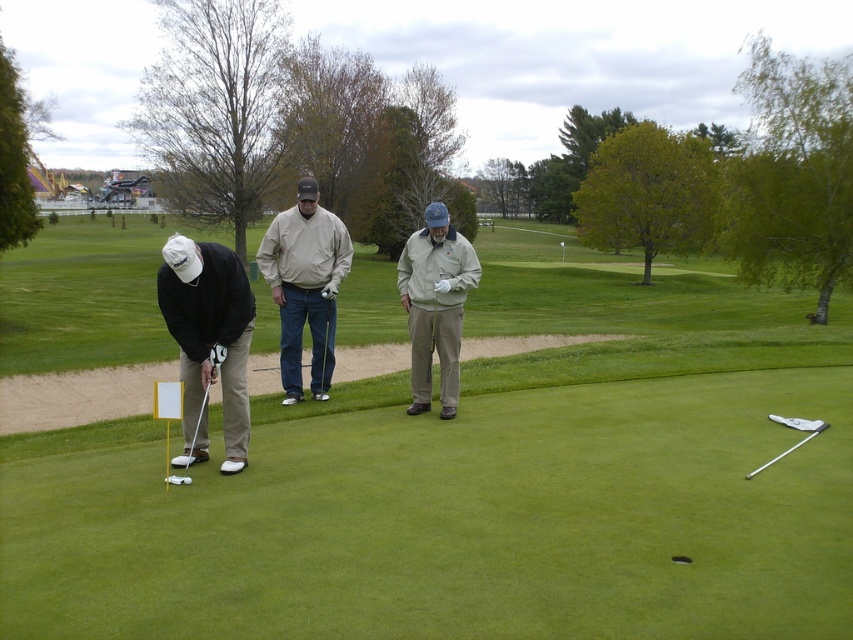
Question: Considering the real-world distances, which object is farthest from the beige cotton shirt at center?

Choices:
 (A) green grass golf course at center
 (B) matte black golf club at lower left
 (C) khaki cotton jacket at center

Answer: (A)

Question: Which point appears farthest from the camera in this image?

Choices:
 (A) (424, 248)
 (B) (293, 264)
 (C) (233, 472)

Answer: (B)

Question: Observing the image, what is the correct spatial positioning of green grass golf course at center in reference to metallic silver golf club at lower right?

Choices:
 (A) left
 (B) right

Answer: (A)

Question: Does green grass golf course at center have a smaller size compared to matte black golf club at lower left?

Choices:
 (A) yes
 (B) no

Answer: (B)

Question: Which point is farther from the camera taking this photo?

Choices:
 (A) pos(454,397)
 (B) pos(125,348)

Answer: (B)

Question: Is green grass golf course at center further to camera compared to matte black golf club at lower left?

Choices:
 (A) yes
 (B) no

Answer: (B)